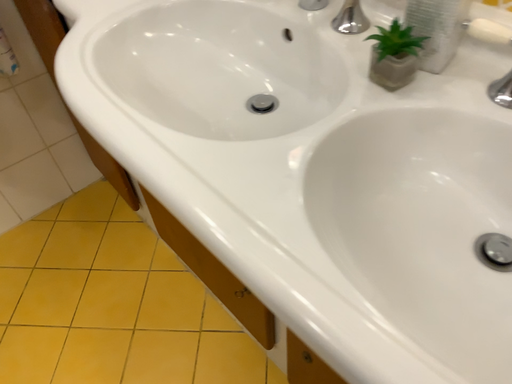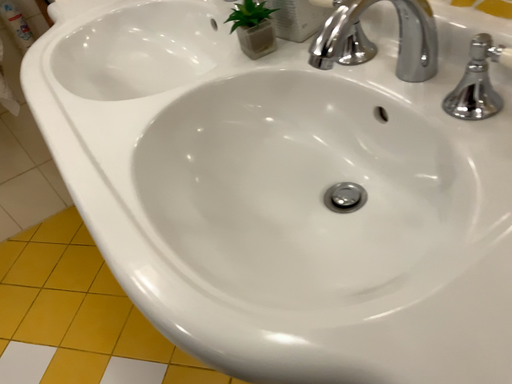
Question: How did the camera likely rotate when shooting the video?

Choices:
 (A) rotated left
 (B) rotated right

Answer: (A)